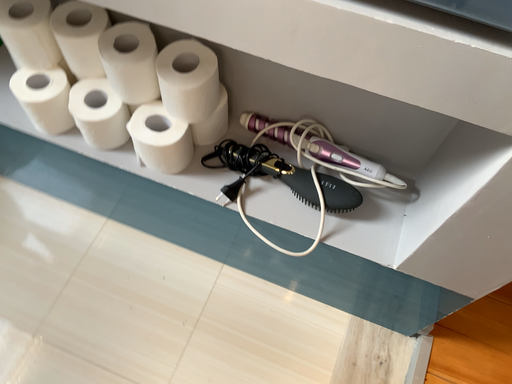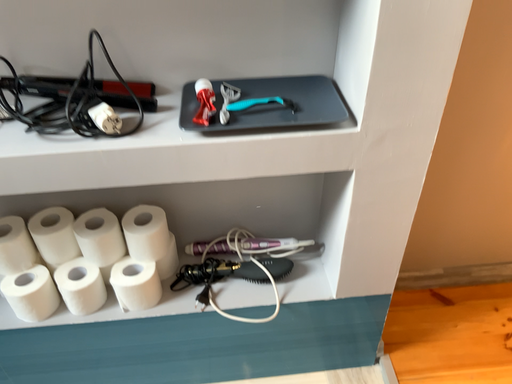
Question: Which way did the camera rotate in the video?

Choices:
 (A) rotated right
 (B) rotated left

Answer: (A)